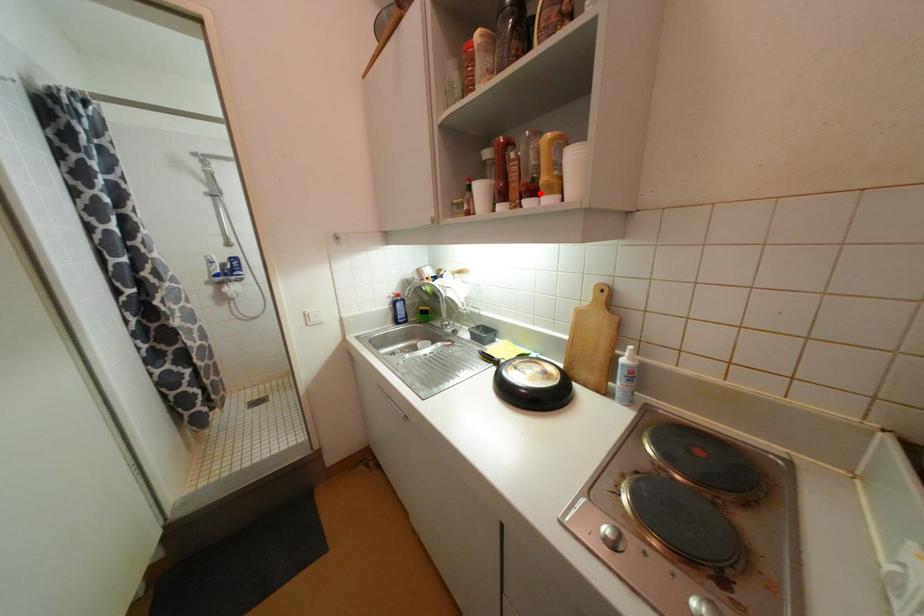
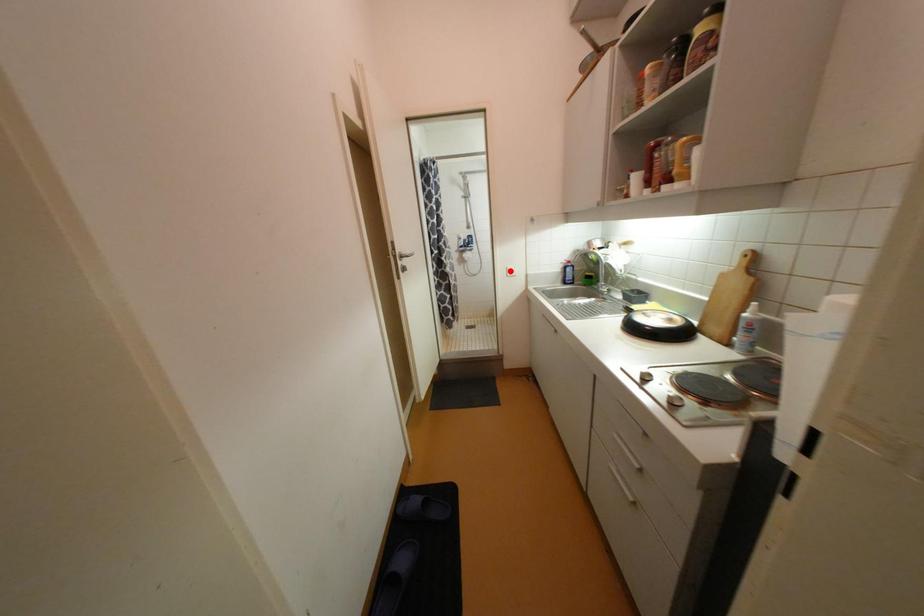
I am providing you with two images of the same scene from different viewpoints. A red point is marked on the first image and another point is marked on the second image. Is the red point in image1 aligned with the point shown in image2?

No